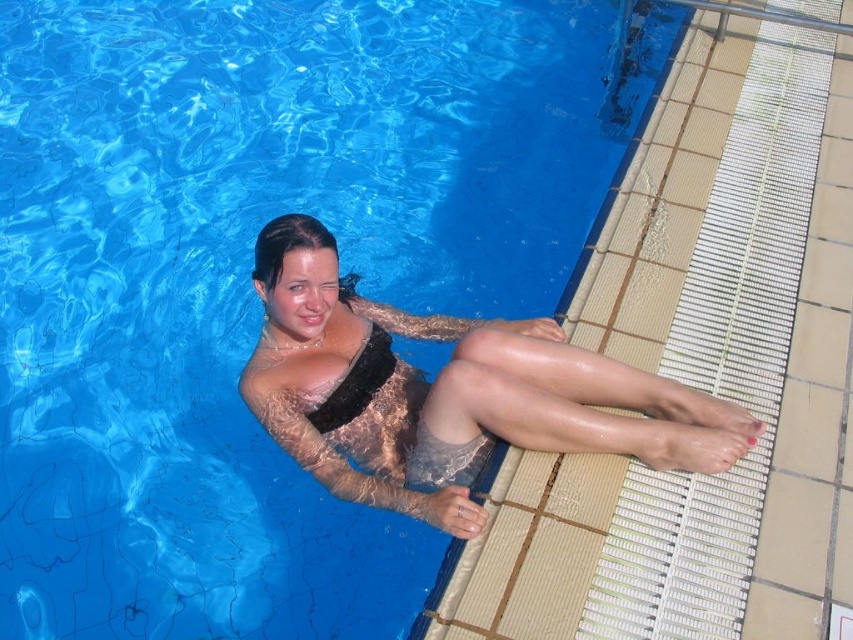
Question: Which object is closer to the camera taking this photo?

Choices:
 (A) lace fabric swimsuit at center
 (B) black fuzzy bikini top at upper center

Answer: (A)

Question: Where is lace fabric swimsuit at center located in relation to black fuzzy bikini top at upper center in the image?

Choices:
 (A) below
 (B) above

Answer: (A)

Question: Which object is closer to the camera taking this photo?

Choices:
 (A) lace fabric swimsuit at center
 (B) black fuzzy bikini top at upper center

Answer: (A)

Question: Is lace fabric swimsuit at center wider than black fuzzy bikini top at upper center?

Choices:
 (A) yes
 (B) no

Answer: (A)

Question: Which point appears farthest from the camera in this image?

Choices:
 (A) (656, 442)
 (B) (381, 342)

Answer: (B)

Question: Is lace fabric swimsuit at center further to the viewer compared to black fuzzy bikini top at upper center?

Choices:
 (A) yes
 (B) no

Answer: (B)